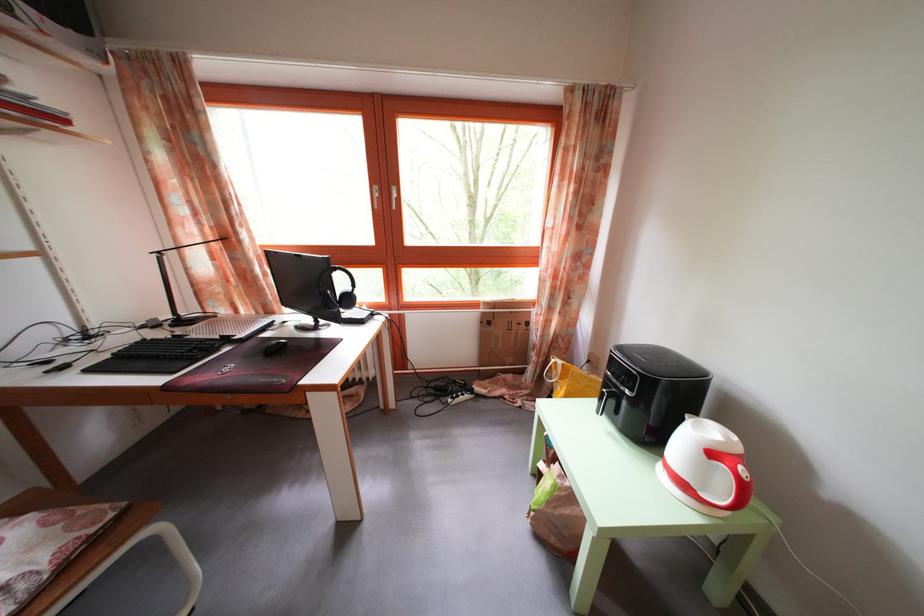
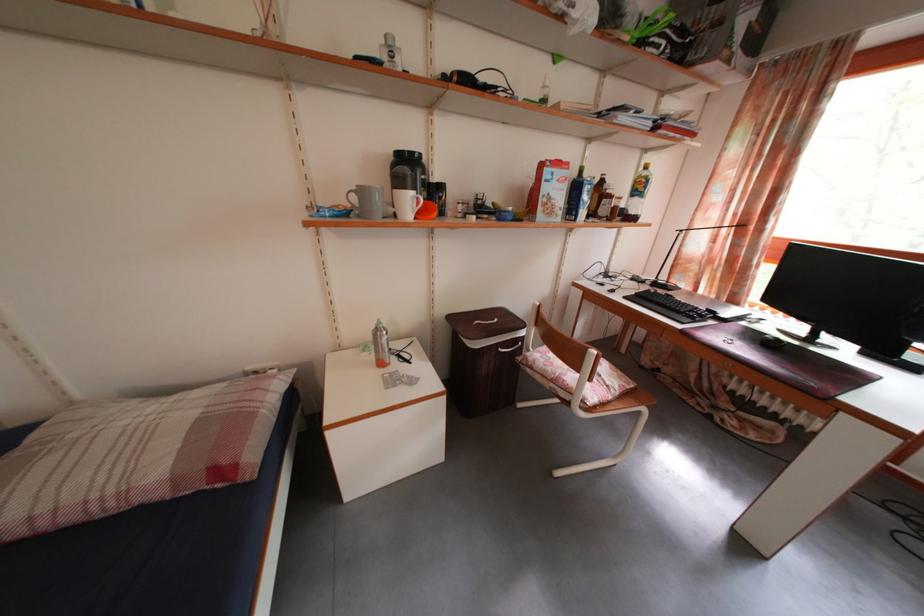
Find the pixel in the second image that matches (x=197, y=318) in the first image.

(671, 285)